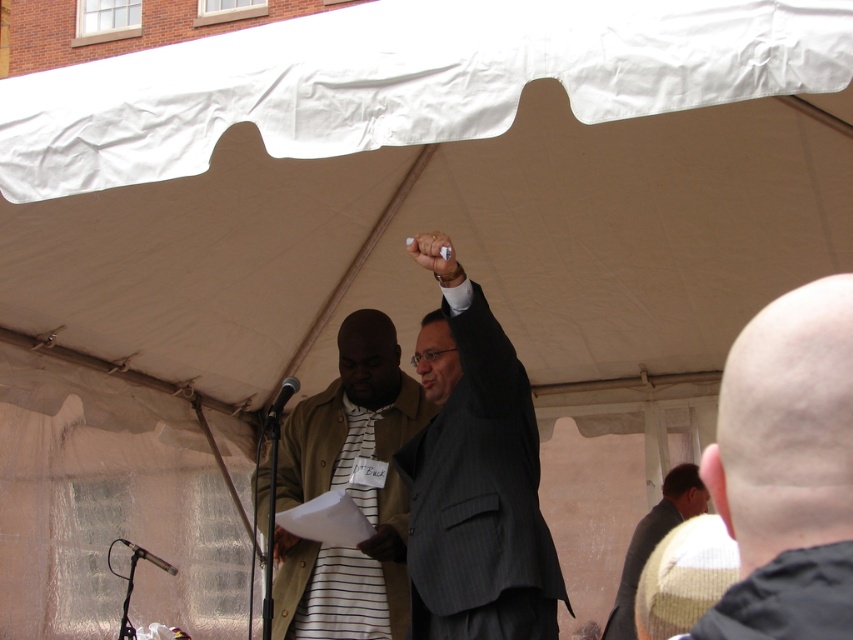
You are attending an outdoor event under a large white tent and notice a man in a pinstriped suit at center. Based on the spatial coordinates provided, can you determine if he is positioned closer to the front or the back of the tent area?

The pinstriped suit at center is located at point 0.778 on the x and 0.563 on the y axis. Since the coordinates are relative to the tent area, a higher x value indicates a position closer to the right side, and a higher y value indicates a position closer to the top. However, without specific axis definitions, we can infer that the pinstriped suit at center is near the center area, so it is neither at the front nor the back but in the middle.

Consider the image. You are a photographer at the event and want to capture both the bald head at upper right and the white matte pen at upper center in a single frame. Given their sizes, which object will appear bigger in your photo?

The bald head at upper right will appear bigger in the photo because it has a larger size compared to the white matte pen at upper center.